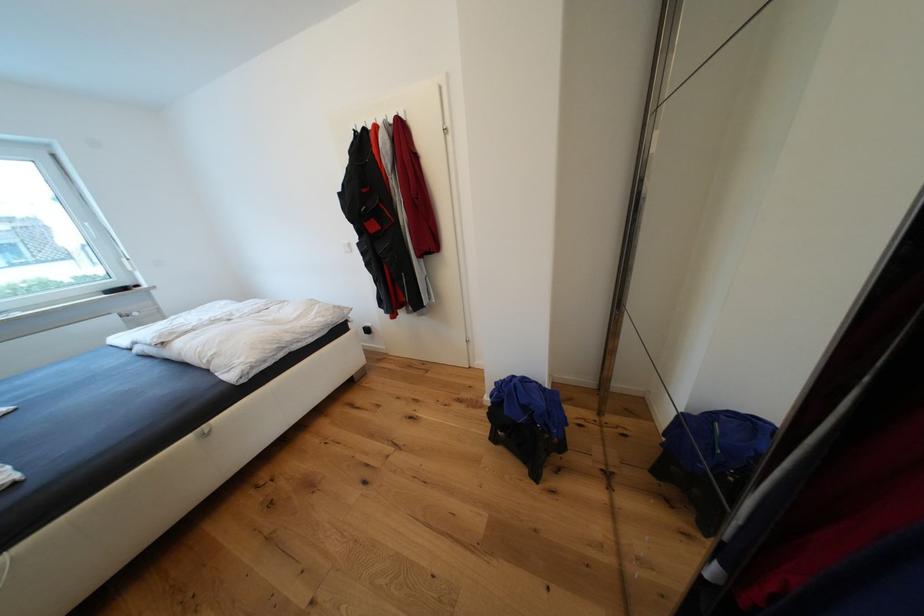
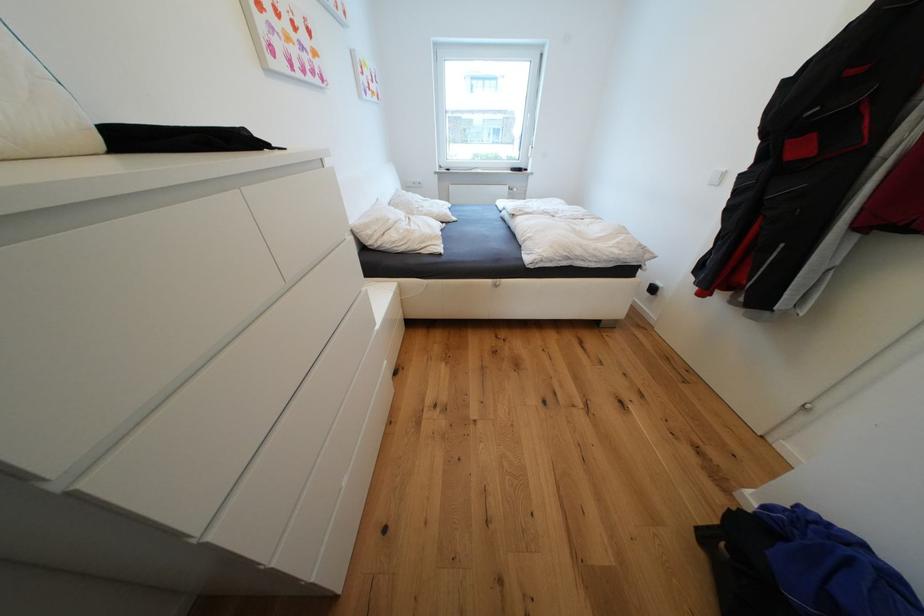
Where in the second image is the point corresponding to point 122,317 from the first image?

(515, 188)